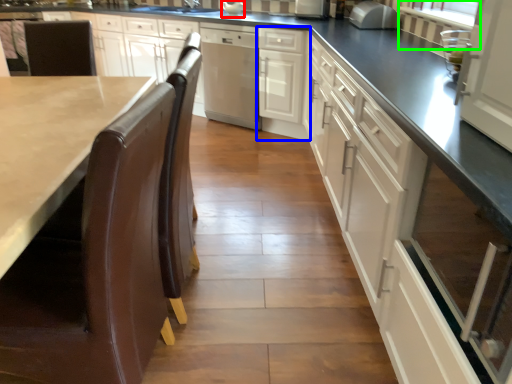
Question: Considering the real-world distances, which object is closest to appliance (highlighted by a red box)? cabinetry (highlighted by a blue box) or window screen (highlighted by a green box).

Choices:
 (A) cabinetry
 (B) window screen

Answer: (A)